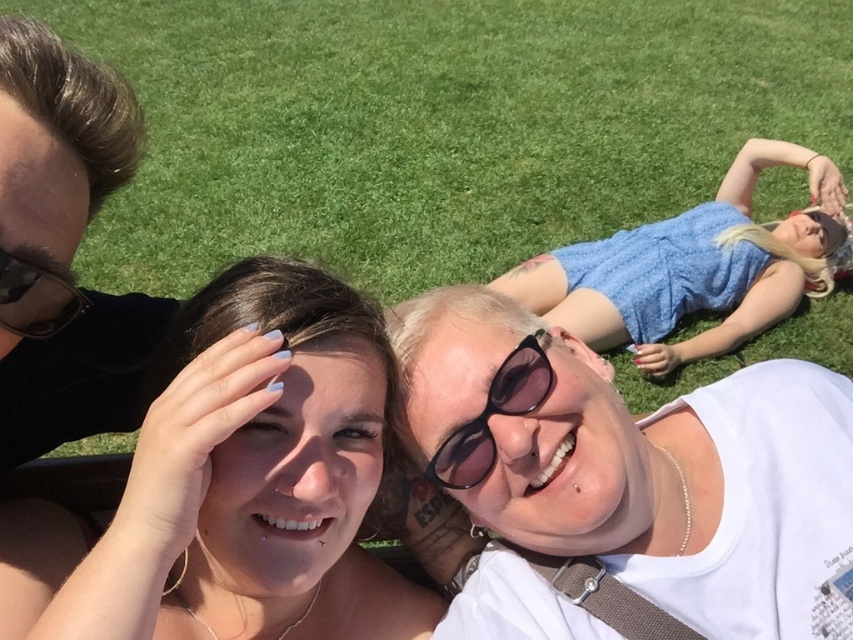
Question: Which point is closer to the camera?

Choices:
 (A) (88, 547)
 (B) (537, 387)
 (C) (24, 321)

Answer: (C)

Question: Is green grass at upper center behind black plastic sunglasses at center?

Choices:
 (A) yes
 (B) no

Answer: (A)

Question: Considering the relative positions of smooth skin face at center and black plastic sunglasses at center in the image provided, where is smooth skin face at center located with respect to black plastic sunglasses at center?

Choices:
 (A) above
 (B) below

Answer: (B)

Question: Can you confirm if green grass at upper center is positioned to the left of smooth skin face at center?

Choices:
 (A) yes
 (B) no

Answer: (B)

Question: Estimate the real-world distances between objects in this image. Which object is closer to the green grass at upper center?

Choices:
 (A) smooth skin face at center
 (B) black plastic sunglasses at center
 (C) matte black sunglasses at upper left

Answer: (A)

Question: Which of the following is the farthest from the observer?

Choices:
 (A) matte black sunglasses at upper left
 (B) green grass at upper center

Answer: (B)